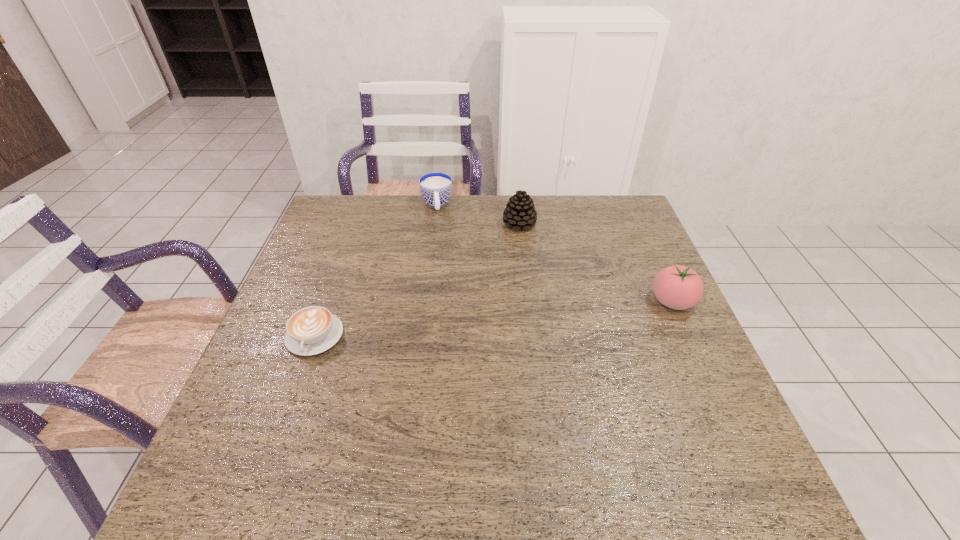
The width and height of the screenshot is (960, 540). Identify the location of free space on the desktop that is between the leftmost object and the rightmost object and is positioned at the narrow end of the third object from left to right. (488, 319).

In order to click on vacant space on the desktop that is between the shortest object and the tomato and is positioned on the side of the second shortest object with the handle in this screenshot , I will do `click(449, 323)`.